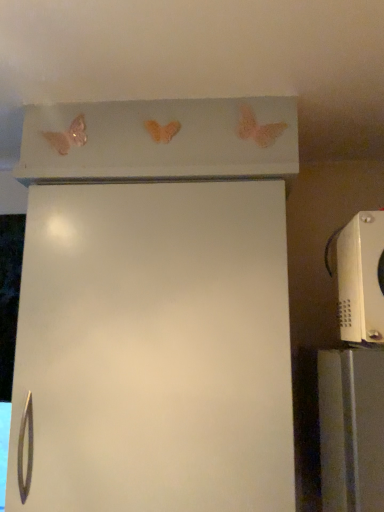
Find the location of a particular element. white matte refrigerator at center is located at coordinates (155, 308).

What do you see at coordinates (155, 308) in the screenshot?
I see `white matte refrigerator at center` at bounding box center [155, 308].

The width and height of the screenshot is (384, 512). Find the location of `white matte refrigerator at center`. white matte refrigerator at center is located at coordinates (155, 308).